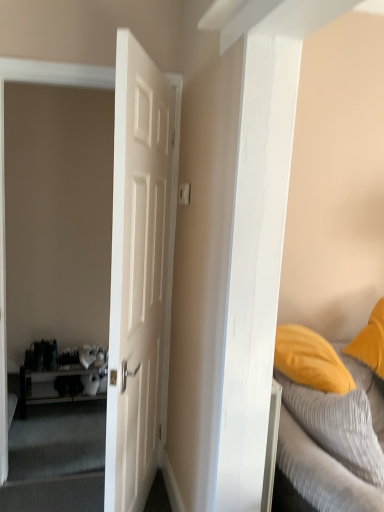
What is the approximate height of wooden shelf at left?

The height of wooden shelf at left is 14.10 inches.

This screenshot has width=384, height=512. What do you see at coordinates (54, 386) in the screenshot?
I see `wooden shelf at left` at bounding box center [54, 386].

What do you see at coordinates (333, 419) in the screenshot?
I see `textured gray bed at right` at bounding box center [333, 419].

This screenshot has width=384, height=512. Identify the location of white matte door at center. (140, 273).

Which of these two, wooden shelf at left or textured gray bed at right, is smaller?

With smaller size is wooden shelf at left.

At what (x,y) coordinates should I click in order to perform the action: click on table beneath the textured gray bed at right (from a real-world perspective). Please return your answer as a coordinate pair (x, y). Looking at the image, I should click on (54, 386).

Is wooden shelf at left looking in the opposite direction of textured gray bed at right?

No, wooden shelf at left is not facing the opposite direction of textured gray bed at right.

Can wooden shelf at left be found inside white matte door at center?

Actually, wooden shelf at left is outside white matte door at center.

Which object is thinner, white matte door at center or wooden shelf at left?

white matte door at center is thinner.

From the image's perspective, between white matte door at center and wooden shelf at left, who is located below?

wooden shelf at left appears lower in the image.

Are white matte door at center and wooden shelf at left located far from each other?

Yes, white matte door at center and wooden shelf at left are quite far apart.

Is textured gray bed at right facing away from wooden shelf at left?

That's not correct — textured gray bed at right is not looking away from wooden shelf at left.

Is textured gray bed at right not near wooden shelf at left?

Indeed, textured gray bed at right is not near wooden shelf at left.

From a real-world perspective, is textured gray bed at right physically located above or below wooden shelf at left?

textured gray bed at right is above wooden shelf at left.

Considering the positions of objects textured gray bed at right and wooden shelf at left in the image provided, who is more to the right, textured gray bed at right or wooden shelf at left?

textured gray bed at right.

Is white matte door at center thinner than textured gray bed at right?

Correct, the width of white matte door at center is less than that of textured gray bed at right.

Looking at this image, is there a large distance between white matte door at center and textured gray bed at right?

Actually, white matte door at center and textured gray bed at right are a little close together.

Is point (132, 440) closer to viewer compared to point (332, 370)?

Yes, point (132, 440) is closer to viewer.

Is white matte door at center further to the viewer compared to textured gray bed at right?

No, it is not.

In the scene shown: Is wooden shelf at left situated inside white matte door at center or outside?

wooden shelf at left is outside white matte door at center.

From the picture: Can you confirm if wooden shelf at left is shorter than white matte door at center?

Yes, wooden shelf at left is shorter than white matte door at center.

Considering the positions of points (37, 375) and (167, 95), is point (37, 375) farther from camera compared to point (167, 95)?

Yes, it is behind point (167, 95).

Based on the photo, from a real-world perspective, which object stands above the other?

white matte door at center, from a real-world perspective.

Is textured gray bed at right surrounding white matte door at center?

No.

Considering the sizes of objects textured gray bed at right and white matte door at center in the image provided, who is bigger, textured gray bed at right or white matte door at center?

Bigger between the two is white matte door at center.

Where is `bed in front of the wooden shelf at left`? The height and width of the screenshot is (512, 384). bed in front of the wooden shelf at left is located at coordinates (333, 419).

Identify the location of table below the white matte door at center (from a real-world perspective). The height and width of the screenshot is (512, 384). (54, 386).

Looking at the image, which one is located closer to textured gray bed at right, wooden shelf at left or white matte door at center?

white matte door at center is closer to textured gray bed at right.

Estimate the real-world distances between objects in this image. Which object is further from white matte door at center, textured gray bed at right or wooden shelf at left?

wooden shelf at left is positioned further to the anchor white matte door at center.

When comparing their distances from wooden shelf at left, does white matte door at center or textured gray bed at right seem further?

The object further to wooden shelf at left is textured gray bed at right.

Looking at the image, which one is located further to textured gray bed at right, white matte door at center or wooden shelf at left?

Among the two, wooden shelf at left is located further to textured gray bed at right.

Estimate the real-world distances between objects in this image. Which object is further from white matte door at center, wooden shelf at left or textured gray bed at right?

wooden shelf at left is positioned further to the anchor white matte door at center.

Estimate the real-world distances between objects in this image. Which object is closer to wooden shelf at left, textured gray bed at right or white matte door at center?

white matte door at center is positioned closer to the anchor wooden shelf at left.

Locate an element on the screen. The height and width of the screenshot is (512, 384). bed between white matte door at center and wooden shelf at left along the z-axis is located at coordinates (333, 419).